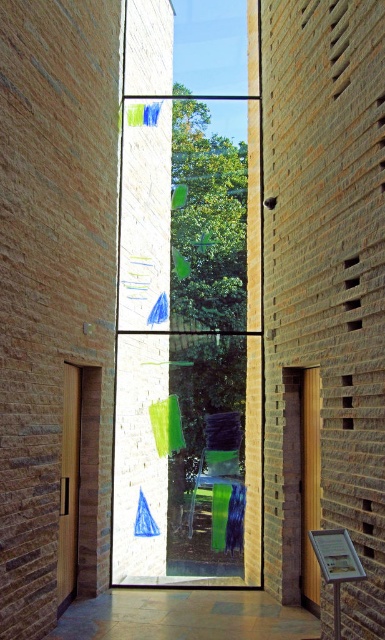
You are standing in the room and want to exit through the wooden door at left. Can you walk directly to it without passing through the transparent glass window at center?

The transparent glass window at center is closer to you than the wooden door at left, so you would have to walk past the transparent glass window at center to reach the wooden door at left.

Looking at this image, you are sitting in the green fabric chair at center and want to look outside through the transparent glass window at center. Can you see the window clearly from your current position?

The transparent glass window at center is further to the viewer than the green fabric chair at center, so you are sitting behind the window. This means the window is between you and the outside view, so you can see outside clearly through it.

You are standing in the room and want to look outside through the transparent glass window at center. Where should you position yourself to have the best view?

The transparent glass window at center is located at point [189,298], so you should position yourself directly in front of that coordinate to have the best view.